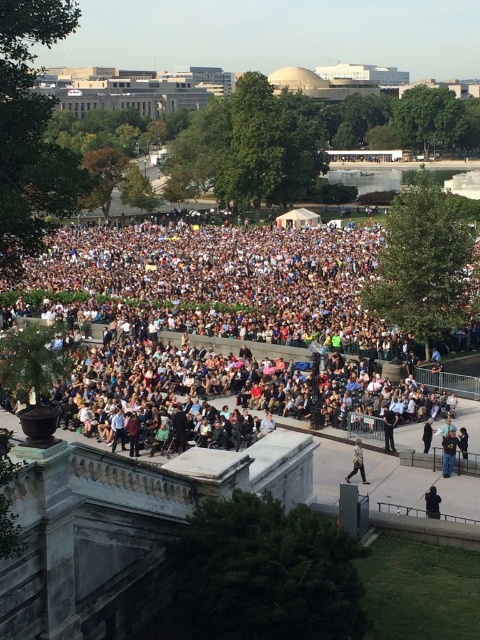
Question: Is denim jacket at lower right above light brown leather jacket at lower center?

Choices:
 (A) yes
 (B) no

Answer: (A)

Question: Which point appears closest to the camera in this image?

Choices:
 (A) (456, 451)
 (B) (359, 448)
 (C) (255, 340)
 (D) (430, 500)

Answer: (D)

Question: Which point appears farthest from the camera in this image?

Choices:
 (A) (358, 452)
 (B) (444, 444)
 (C) (148, 269)

Answer: (C)

Question: Which is nearer to the white cloth crowd at center?

Choices:
 (A) light brown leather jacket at lower center
 (B) black fabric jacket at center
 (C) black leather jacket at lower right
 (D) denim jacket at lower right

Answer: (D)

Question: From the image, what is the correct spatial relationship of black fabric jacket at center in relation to black leather jacket at lower right?

Choices:
 (A) below
 (B) above

Answer: (B)

Question: Does denim jacket at lower right appear over black leather jacket at lower right?

Choices:
 (A) no
 (B) yes

Answer: (B)